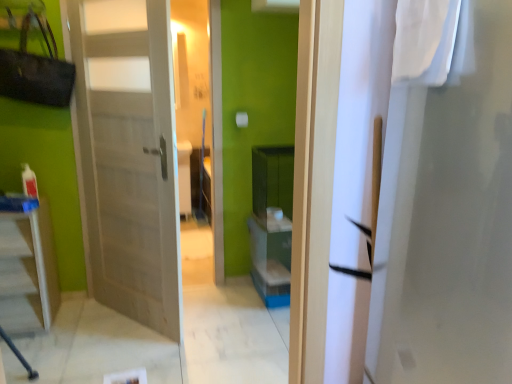
Question: From the image's perspective, is wooden door at left under white fabric at upper right?

Choices:
 (A) yes
 (B) no

Answer: (A)

Question: From a real-world perspective, is wooden door at left under white fabric at upper right?

Choices:
 (A) yes
 (B) no

Answer: (A)

Question: Does wooden door at left lie behind white fabric at upper right?

Choices:
 (A) yes
 (B) no

Answer: (A)

Question: Is there a large distance between wooden door at left and white fabric at upper right?

Choices:
 (A) yes
 (B) no

Answer: (A)

Question: Can we say wooden door at left lies outside white fabric at upper right?

Choices:
 (A) yes
 (B) no

Answer: (A)

Question: Can you confirm if wooden door at left is smaller than white fabric at upper right?

Choices:
 (A) no
 (B) yes

Answer: (A)

Question: Could you tell me if white glossy table at lower left is turned towards white fabric at upper right?

Choices:
 (A) no
 (B) yes

Answer: (A)

Question: Does white glossy table at lower left have a greater width compared to white fabric at upper right?

Choices:
 (A) yes
 (B) no

Answer: (A)

Question: From the image's perspective, is white glossy table at lower left on white fabric at upper right?

Choices:
 (A) yes
 (B) no

Answer: (B)

Question: Is white glossy table at lower left to the left of white fabric at upper right from the viewer's perspective?

Choices:
 (A) no
 (B) yes

Answer: (B)

Question: Is white glossy table at lower left in front of white fabric at upper right?

Choices:
 (A) no
 (B) yes

Answer: (A)

Question: Is white glossy table at lower left next to white fabric at upper right and touching it?

Choices:
 (A) yes
 (B) no

Answer: (B)

Question: Is wooden door at left at the right side of white glossy table at lower left?

Choices:
 (A) no
 (B) yes

Answer: (B)